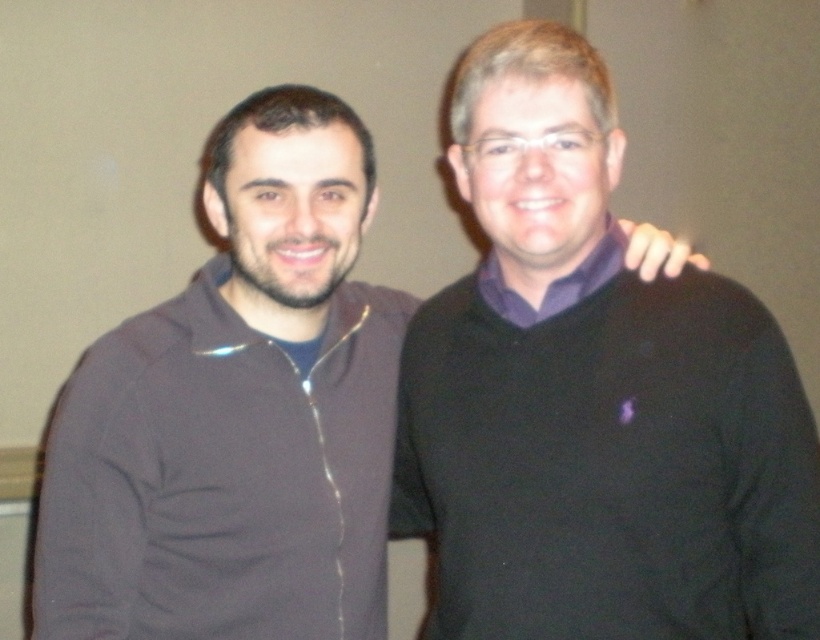
Who is taller, black sweater at center or dark matte sweater at center?

black sweater at center is taller.

Can you confirm if black sweater at center is positioned above dark matte sweater at center?

Yes.

The width and height of the screenshot is (820, 640). I want to click on black sweater at center, so click(x=593, y=396).